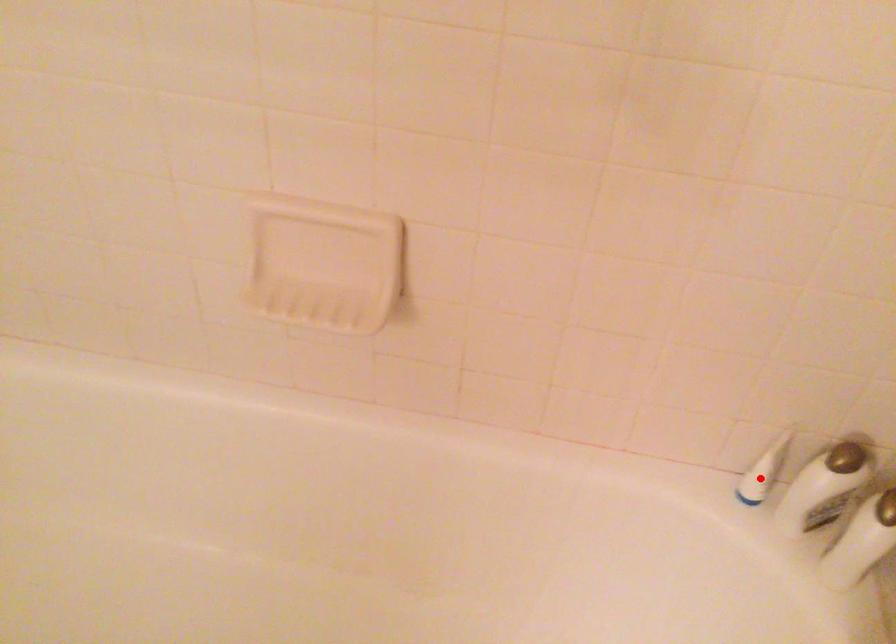
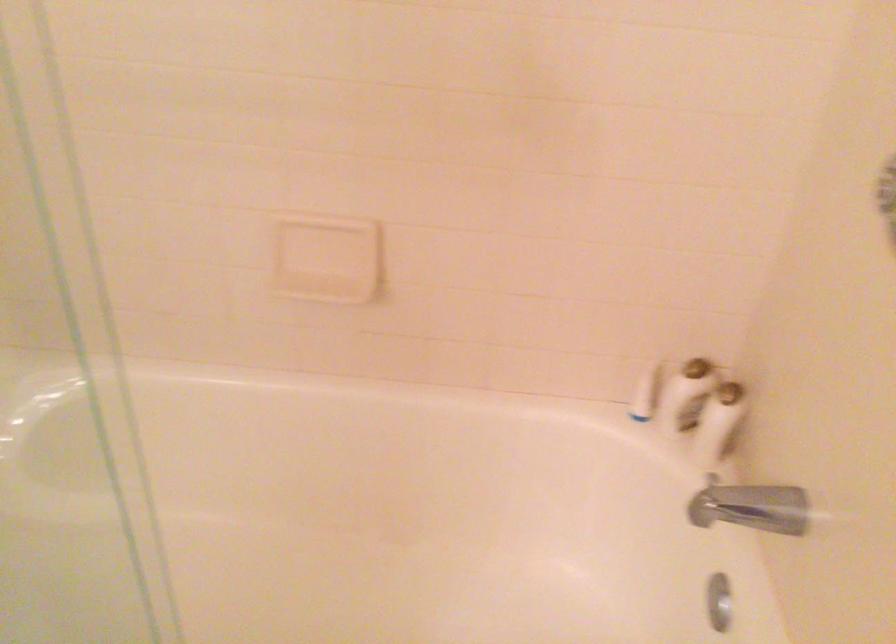
Where in the second image is the point corresponding to the highlighted location from the first image?

(644, 393)